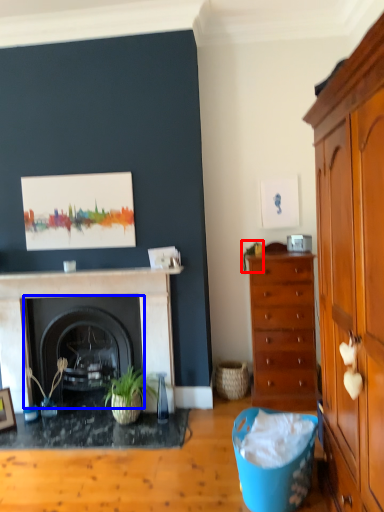
Question: Among these objects, which one is nearest to the camera, plant (highlighted by a red box) or fireplace (highlighted by a blue box)?

Choices:
 (A) plant
 (B) fireplace

Answer: (B)